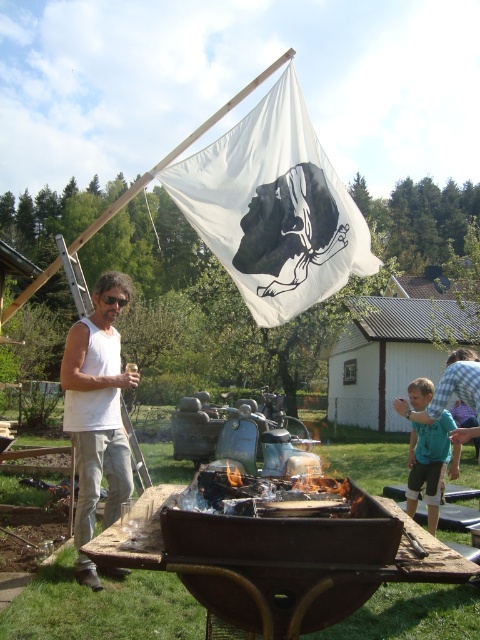
Does white fabric flag at upper center appear on the right side of teal fabric shirt at right?

No, white fabric flag at upper center is not to the right of teal fabric shirt at right.

Between point (187, 182) and point (407, 488), which one is positioned in front?

Point (187, 182) is in front.

Which is in front, point (256, 134) or point (431, 525)?

Positioned in front is point (431, 525).

Identify the location of white fabric flag at upper center. Image resolution: width=480 pixels, height=640 pixels. (274, 209).

What do you see at coordinates (274, 209) in the screenshot?
I see `white fabric flag at upper center` at bounding box center [274, 209].

Is white fabric flag at upper center to the left of charcoal grill at center from the viewer's perspective?

No, white fabric flag at upper center is not to the left of charcoal grill at center.

Who is more distant from viewer, [333,196] or [315,480]?

The point [333,196] is behind.

Locate an element on the screen. The width and height of the screenshot is (480, 640). white fabric flag at upper center is located at coordinates (274, 209).

Between white sleeveless shirt at left and charcoal grill at center, which one has more height?

white sleeveless shirt at left is taller.

Who is more distant from viewer, (72, 387) or (330, 483)?

The point (72, 387) is more distant.

Where is `white sleeveless shirt at left`? The height and width of the screenshot is (640, 480). white sleeveless shirt at left is located at coordinates (97, 404).